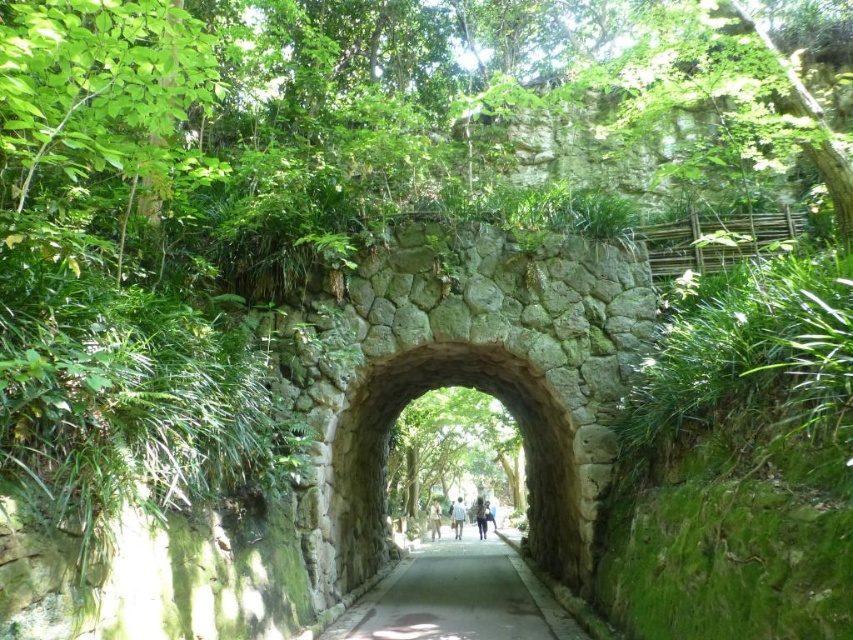
Who is positioned more to the left, gray concrete path at center or blue fabric bag at center?

Positioned to the left is blue fabric bag at center.

Who is lower down, gray concrete path at center or blue fabric bag at center?

blue fabric bag at center is below.

Which is behind, point (373, 636) or point (451, 520)?

Point (451, 520)

Locate an element on the screen. gray concrete path at center is located at coordinates (x=457, y=596).

Does natural stone archway at center have a lesser width compared to light brown textured shirt at center?

No, natural stone archway at center is not thinner than light brown textured shirt at center.

Image resolution: width=853 pixels, height=640 pixels. What do you see at coordinates (523, 444) in the screenshot?
I see `natural stone archway at center` at bounding box center [523, 444].

The width and height of the screenshot is (853, 640). Identify the location of natural stone archway at center. (523, 444).

Between natural stone archway at center and gray concrete path at center, which one appears on the left side from the viewer's perspective?

Positioned to the left is natural stone archway at center.

Locate an element on the screen. natural stone archway at center is located at coordinates (523, 444).